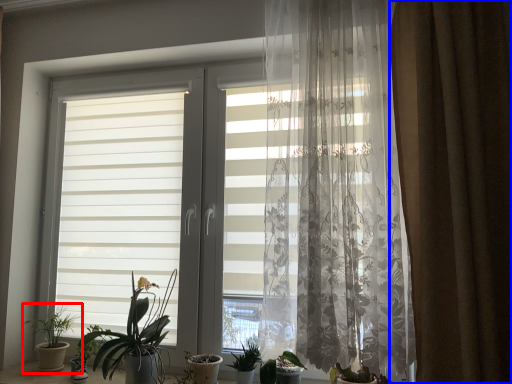
Question: Which object is closer to the camera taking this photo, houseplant (highlighted by a red box) or curtain (highlighted by a blue box)?

Choices:
 (A) houseplant
 (B) curtain

Answer: (B)